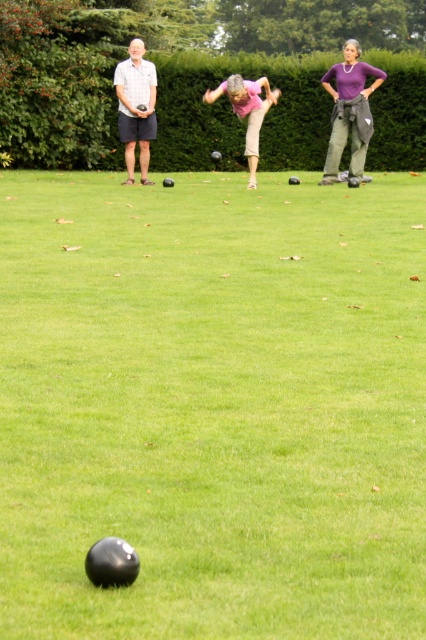
Question: Among these points, which one is farthest from the camera?

Choices:
 (A) (350, 93)
 (B) (250, 237)

Answer: (A)

Question: Does purple matte shirt at upper right appear on the right side of pink fabric pants at center?

Choices:
 (A) no
 (B) yes

Answer: (B)

Question: Considering the relative positions of green grass at center and purple matte shirt at upper right in the image provided, where is green grass at center located with respect to purple matte shirt at upper right?

Choices:
 (A) above
 (B) below

Answer: (B)

Question: Which of these objects is positioned closest to the purple matte shirt at upper right?

Choices:
 (A) pink fabric pants at center
 (B) green grass at center
 (C) matte gray shorts at left

Answer: (A)

Question: Which point appears closest to the camera in this image?

Choices:
 (A) (195, 330)
 (B) (138, 84)

Answer: (A)

Question: Does green grass at center lie behind purple matte shirt at upper right?

Choices:
 (A) yes
 (B) no

Answer: (B)